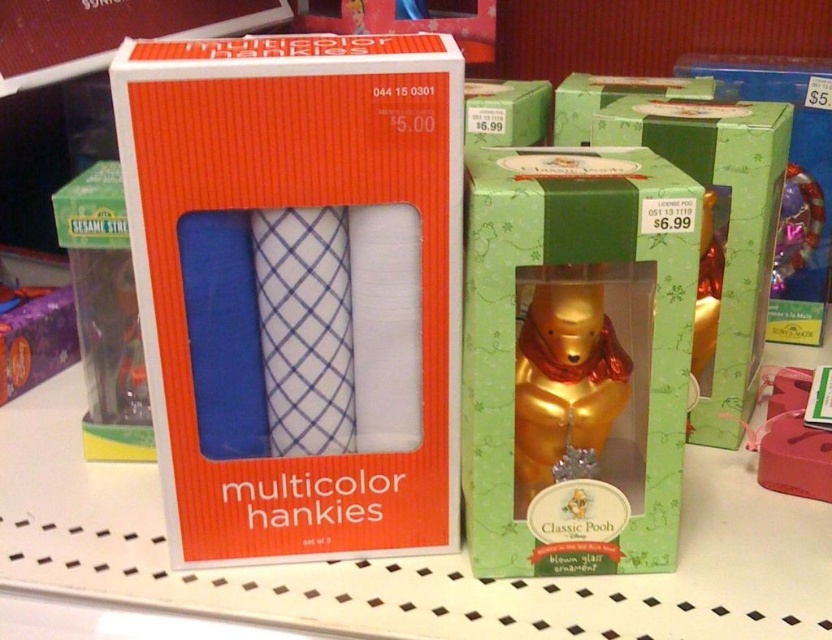
Is orange matte box of multicolor hankies at center smaller than gold glass ornament at center?

Correct, orange matte box of multicolor hankies at center occupies less space than gold glass ornament at center.

Which is below, orange matte box of multicolor hankies at center or gold glass ornament at center?

gold glass ornament at center is lower down.

Does point (423, 316) lie behind point (661, 285)?

Yes, it is.

You are a GUI agent. You are given a task and a screenshot of the screen. Output one action in this format:
    pyautogui.click(x=<x>, y=<y>)
    Task: Click on the orange matte box of multicolor hankies at center
    Image resolution: width=832 pixels, height=640 pixels.
    Given the screenshot: What is the action you would take?
    point(298,289)

Can you confirm if metallic gold bear at center is smaller than gold metallic bear at center?

Incorrect, metallic gold bear at center is not smaller in size than gold metallic bear at center.

Which of these two, metallic gold bear at center or gold metallic bear at center, stands shorter?

gold metallic bear at center is shorter.

Between point (765, 320) and point (577, 324), which one is positioned behind?

The point (765, 320) is more distant.

I want to click on metallic gold bear at center, so click(x=719, y=234).

Between orange matte box of multicolor hankies at center and gold metallic bear at center, which one appears on the left side from the viewer's perspective?

orange matte box of multicolor hankies at center

Who is taller, orange matte box of multicolor hankies at center or gold metallic bear at center?

orange matte box of multicolor hankies at center is taller.

Describe the element at coordinates (298, 289) in the screenshot. I see `orange matte box of multicolor hankies at center` at that location.

I want to click on orange matte box of multicolor hankies at center, so click(x=298, y=289).